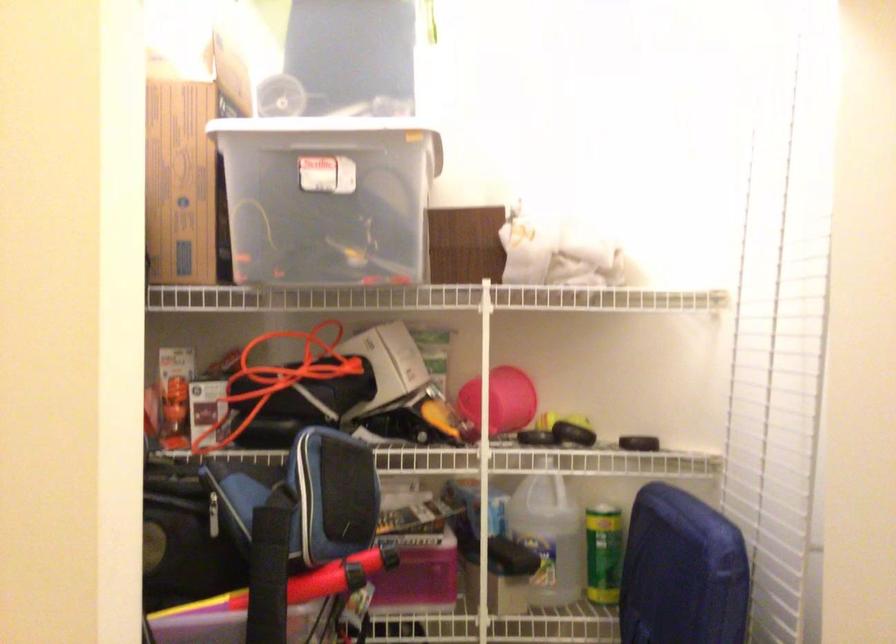
Where would you lift the storage bin handle? Please return your answer as a coordinate pair (x, y).

(313, 133)